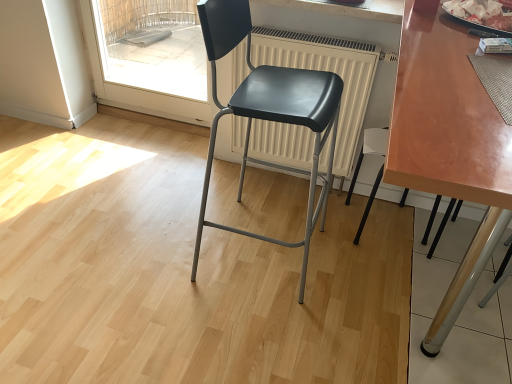
The height and width of the screenshot is (384, 512). I want to click on vacant space positioned to the left of matte black chair at lower right, marked as the 1th chair in a right-to-left arrangement, so click(x=308, y=218).